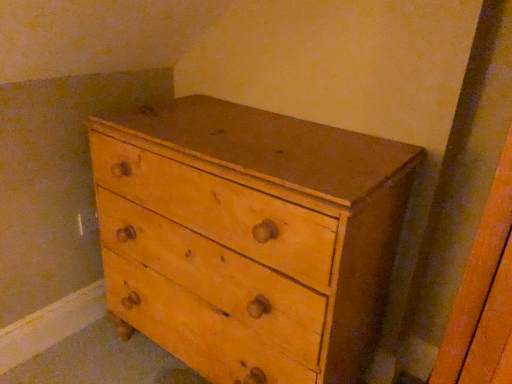
Describe the element at coordinates (249, 237) in the screenshot. The image size is (512, 384). I see `wooden chest of drawers at center` at that location.

This screenshot has height=384, width=512. In order to click on wooden chest of drawers at center in this screenshot , I will do `click(249, 237)`.

Identify the location of wooden chest of drawers at center. The height and width of the screenshot is (384, 512). (249, 237).